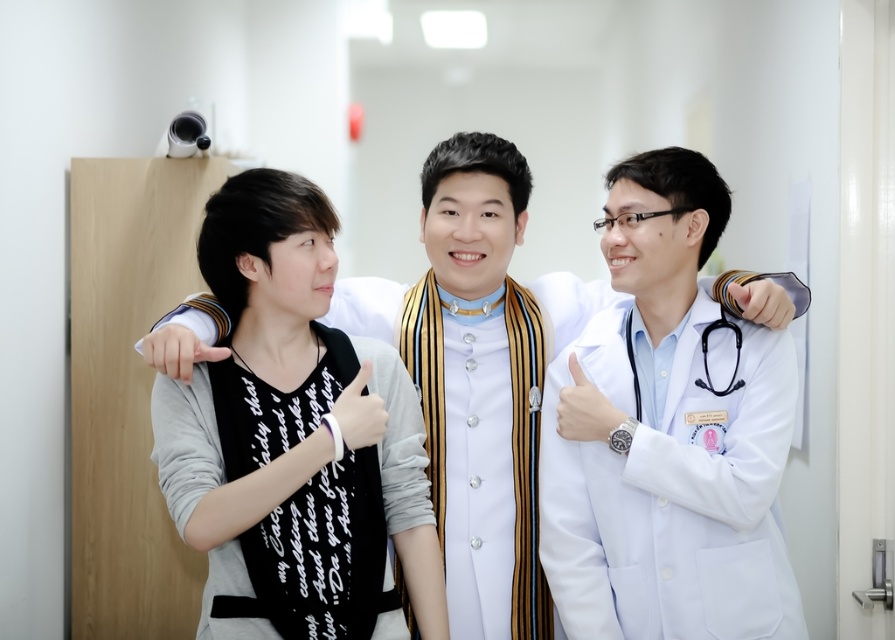
Question: Which of the following is the closest to the observer?

Choices:
 (A) (280, 502)
 (B) (573, 406)

Answer: (A)

Question: Is white matte lab coat at center below white matte watch at center?

Choices:
 (A) yes
 (B) no

Answer: (B)

Question: Which object appears farthest from the camera in this image?

Choices:
 (A) white matte lab coat at center
 (B) black rubber stethoscope at center
 (C) white smooth lab coat at center

Answer: (B)

Question: Considering the relative positions of white smooth lab coat at center and black rubber stethoscope at center in the image provided, where is white smooth lab coat at center located with respect to black rubber stethoscope at center?

Choices:
 (A) left
 (B) right

Answer: (A)

Question: Does white matte lab coat at center appear over black rubber stethoscope at center?

Choices:
 (A) no
 (B) yes

Answer: (A)

Question: Which object appears closest to the camera in this image?

Choices:
 (A) black matte shirt at center
 (B) white matte lab coat at center
 (C) white matte stethoscope at center

Answer: (A)